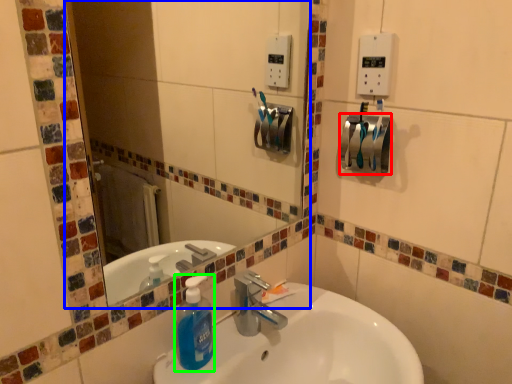
Question: Which is nearer to the towel bar (highlighted by a red box)? mirror (highlighted by a blue box) or cleaning product (highlighted by a green box).

Choices:
 (A) mirror
 (B) cleaning product

Answer: (B)